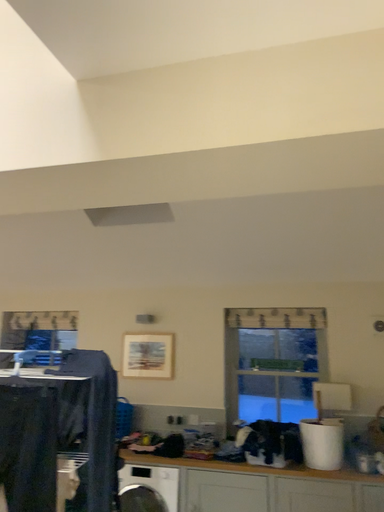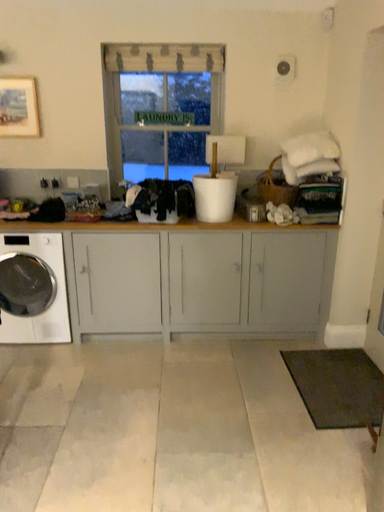
Question: How did the camera likely rotate when shooting the video?

Choices:
 (A) rotated upward
 (B) rotated downward

Answer: (B)